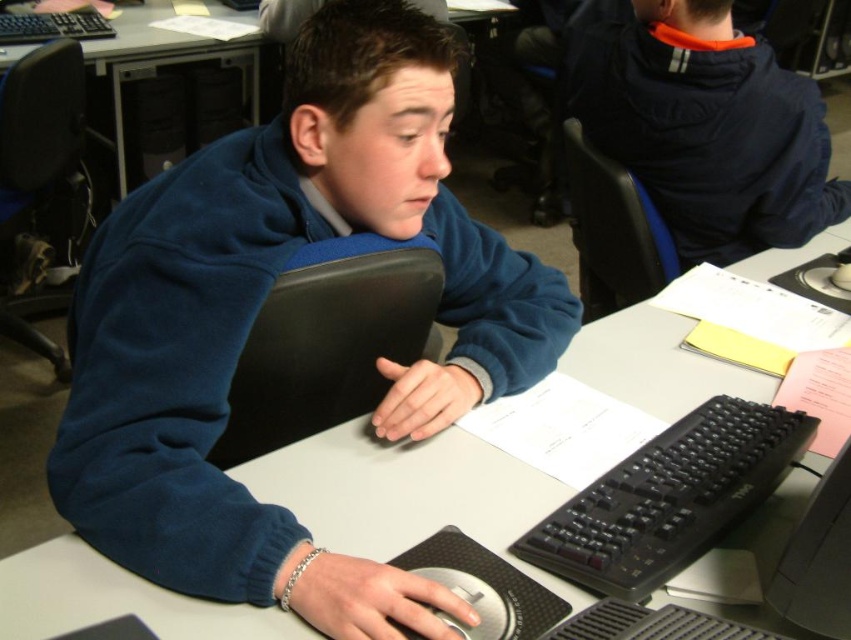
Does dark blue fleece jacket at upper right have a lesser height compared to black plastic keyboard at lower center?

In fact, dark blue fleece jacket at upper right may be taller than black plastic keyboard at lower center.

Is point (650, 144) closer to viewer compared to point (804, 420)?

No, (650, 144) is further to viewer.

Describe the element at coordinates (701, 124) in the screenshot. I see `dark blue fleece jacket at upper right` at that location.

This screenshot has height=640, width=851. Find the location of `dark blue fleece jacket at upper right`. dark blue fleece jacket at upper right is located at coordinates (701, 124).

Is dark blue fleece jacket at upper right positioned at the back of black plastic keyboard at upper left?

No, dark blue fleece jacket at upper right is in front of black plastic keyboard at upper left.

Is dark blue fleece jacket at upper right to the left of black plastic keyboard at upper left from the viewer's perspective?

No, dark blue fleece jacket at upper right is not to the left of black plastic keyboard at upper left.

Which is behind, point (689, 202) or point (10, 35)?

The point (10, 35) is more distant.

Where is `dark blue fleece jacket at upper right`? The image size is (851, 640). dark blue fleece jacket at upper right is located at coordinates (701, 124).

Find the location of a particular element. The height and width of the screenshot is (640, 851). blue fleece jacket at center is located at coordinates (256, 312).

Can you confirm if blue fleece jacket at center is positioned to the left of black plastic keyboard at center?

Yes, blue fleece jacket at center is to the left of black plastic keyboard at center.

Is point (431, 65) closer to viewer compared to point (93, 604)?

No.

Locate an element on the screen. blue fleece jacket at center is located at coordinates (256, 312).